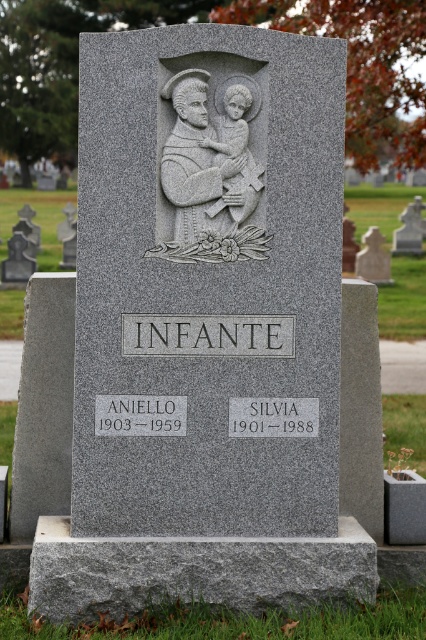
Question: Which object is positioned farthest from the granite gravestone at center?

Choices:
 (A) gray stone sculpture of man holding child at center
 (B) gray granite statue at upper center

Answer: (A)

Question: Is gray granite statue at upper center positioned in front of granite gravestone at center?

Choices:
 (A) yes
 (B) no

Answer: (A)

Question: Can you confirm if gray stone sculpture of man holding child at center is positioned to the right of granite gravestone at center?

Choices:
 (A) no
 (B) yes

Answer: (A)

Question: Which object is positioned closest to the gray granite statue at upper center?

Choices:
 (A) granite gravestone at center
 (B) gray stone sculpture of man holding child at center

Answer: (A)

Question: Does gray stone sculpture of man holding child at center have a smaller size compared to granite gravestone at center?

Choices:
 (A) yes
 (B) no

Answer: (A)

Question: Which point is closer to the camera?

Choices:
 (A) (172, 76)
 (B) (399, 228)

Answer: (A)